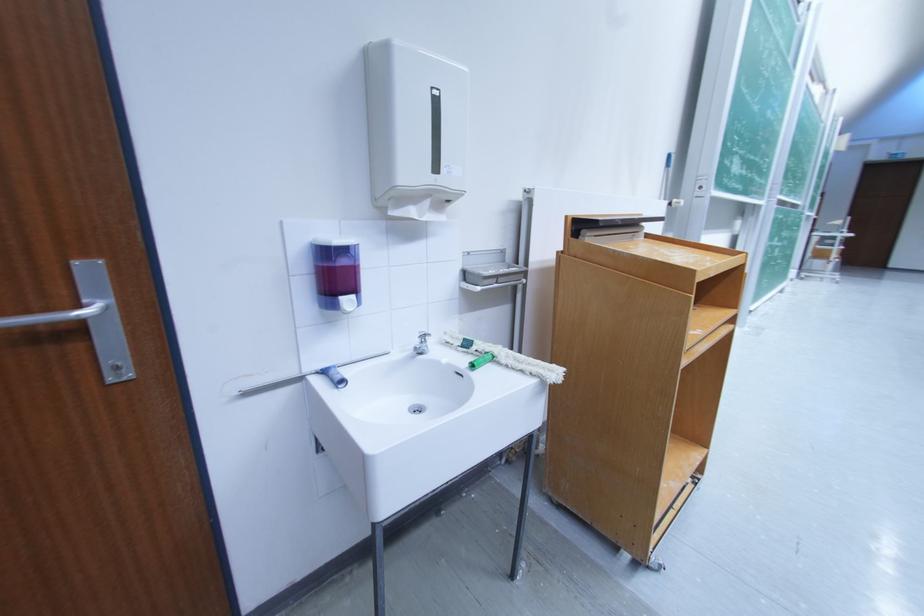
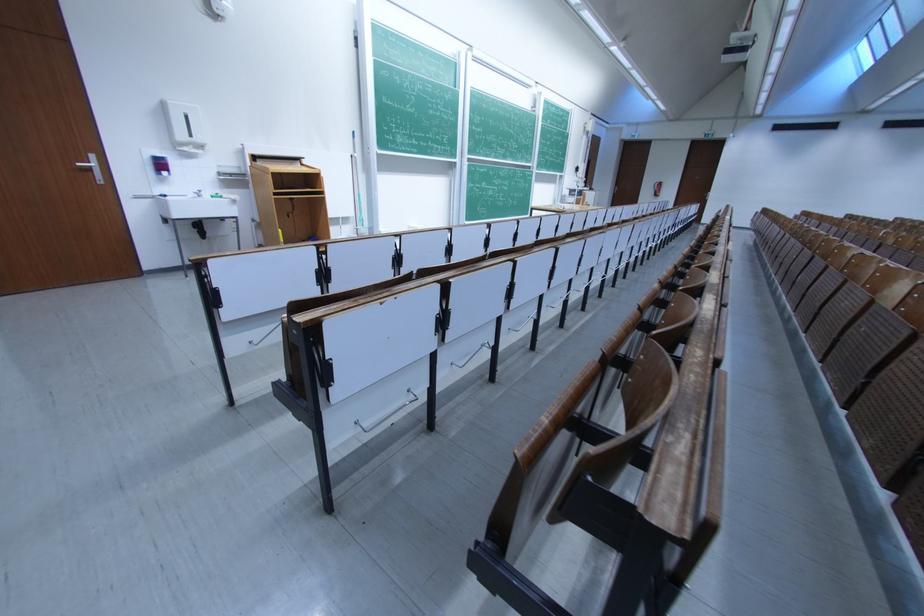
Find the pixel in the second image that matches pixel 454 180 in the first image.

(205, 142)